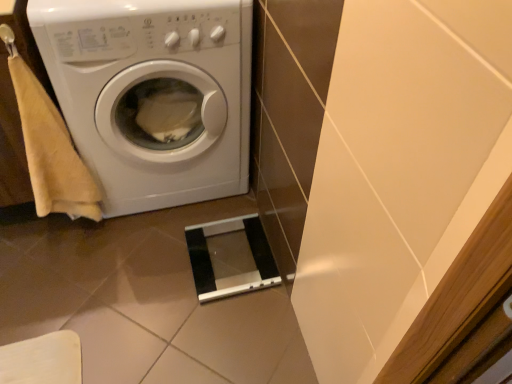
Question: From a real-world perspective, is beige cotton hand towel at left above or below white glossy washing machine at left?

Choices:
 (A) below
 (B) above

Answer: (B)

Question: Considering the positions of beige cotton hand towel at left and white glossy washing machine at left in the image, is beige cotton hand towel at left bigger or smaller than white glossy washing machine at left?

Choices:
 (A) big
 (B) small

Answer: (B)

Question: Considering the positions of beige cotton hand towel at left and white glossy washing machine at left in the image, is beige cotton hand towel at left wider or thinner than white glossy washing machine at left?

Choices:
 (A) wide
 (B) thin

Answer: (B)

Question: From a real-world perspective, is white glossy washing machine at left physically located above or below beige cotton hand towel at left?

Choices:
 (A) below
 (B) above

Answer: (A)

Question: Is white glossy washing machine at left wider or thinner than beige cotton hand towel at left?

Choices:
 (A) thin
 (B) wide

Answer: (B)

Question: Is point (202, 117) closer or farther from the camera than point (74, 155)?

Choices:
 (A) closer
 (B) farther

Answer: (B)

Question: Considering the positions of white glossy washing machine at left and beige cotton hand towel at left in the image, is white glossy washing machine at left bigger or smaller than beige cotton hand towel at left?

Choices:
 (A) big
 (B) small

Answer: (A)